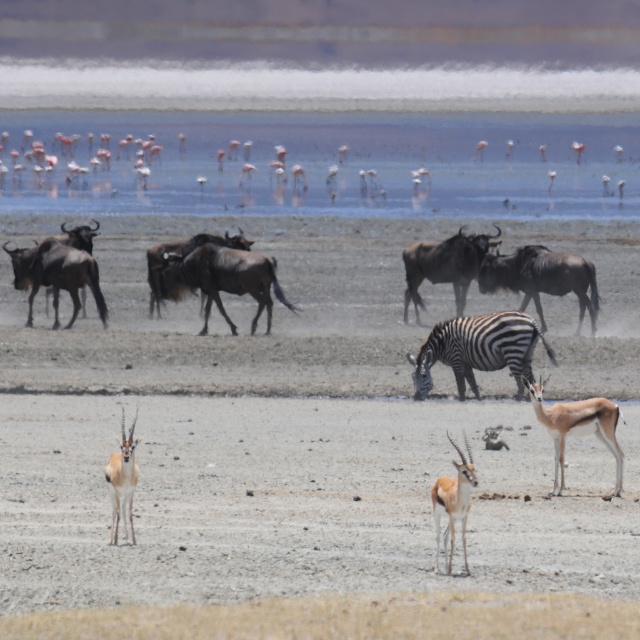
Which of these two, light brown fur antelope at lower center or brown glossy antelope at center, stands shorter?

With less height is brown glossy antelope at center.

Who is more distant from viewer, (x=577, y=410) or (x=465, y=483)?

Positioned behind is point (x=577, y=410).

At what (x,y) coordinates should I click in order to perform the action: click on light brown fur antelope at lower center. Please return your answer as a coordinate pair (x, y). The width and height of the screenshot is (640, 640). Looking at the image, I should click on pos(577,428).

Can you confirm if gray sandy dirt field at center is bigger than brown glossy antelope at center?

Indeed, gray sandy dirt field at center has a larger size compared to brown glossy antelope at center.

Which is behind, point (429, 609) or point (448, 476)?

The point (448, 476) is behind.

Identify the location of gray sandy dirt field at center. (308, 454).

Is brown glossy antelope at center bigger than shiny brown antelope at center?

Actually, brown glossy antelope at center might be smaller than shiny brown antelope at center.

This screenshot has width=640, height=640. I want to click on brown glossy antelope at center, so click(x=452, y=500).